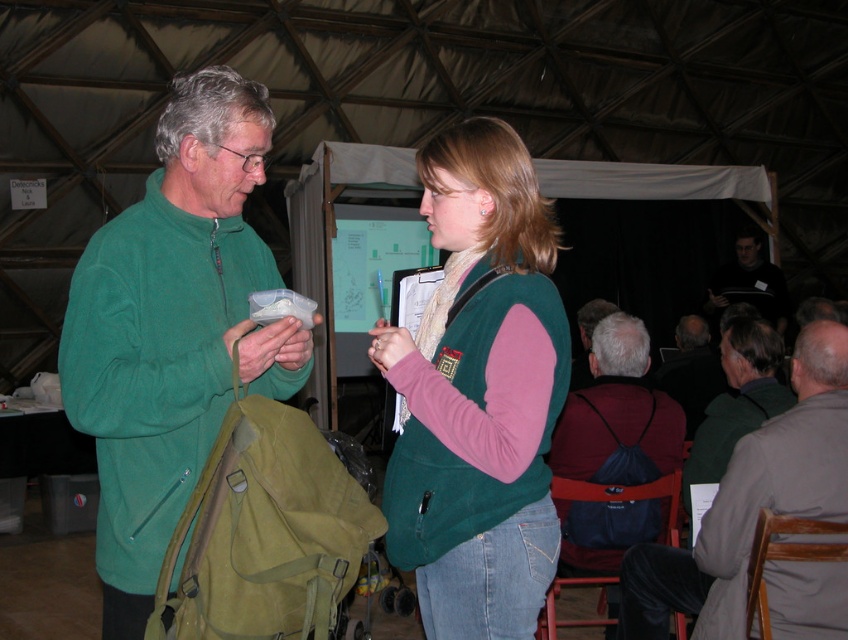
Question: Which of the following is the farthest from the observer?

Choices:
 (A) (646, 577)
 (B) (176, 266)
 (C) (770, 262)
 (D) (679, 353)

Answer: (C)

Question: Does green fleece vest at center have a smaller size compared to dark gray backpack at center?

Choices:
 (A) no
 (B) yes

Answer: (B)

Question: Which point is farther to the camera?

Choices:
 (A) (668, 364)
 (B) (707, 310)
 (C) (572, 547)

Answer: (B)

Question: Does green fleece jacket at left appear on the left side of maroon fabric backpack at lower right?

Choices:
 (A) no
 (B) yes

Answer: (B)

Question: Among these points, which one is nearest to the camera?

Choices:
 (A) (773, 323)
 (B) (777, 620)
 (C) (165, 401)

Answer: (C)

Question: Can you confirm if gray fabric backpack at center is bigger than dark gray backpack at center?

Choices:
 (A) yes
 (B) no

Answer: (B)